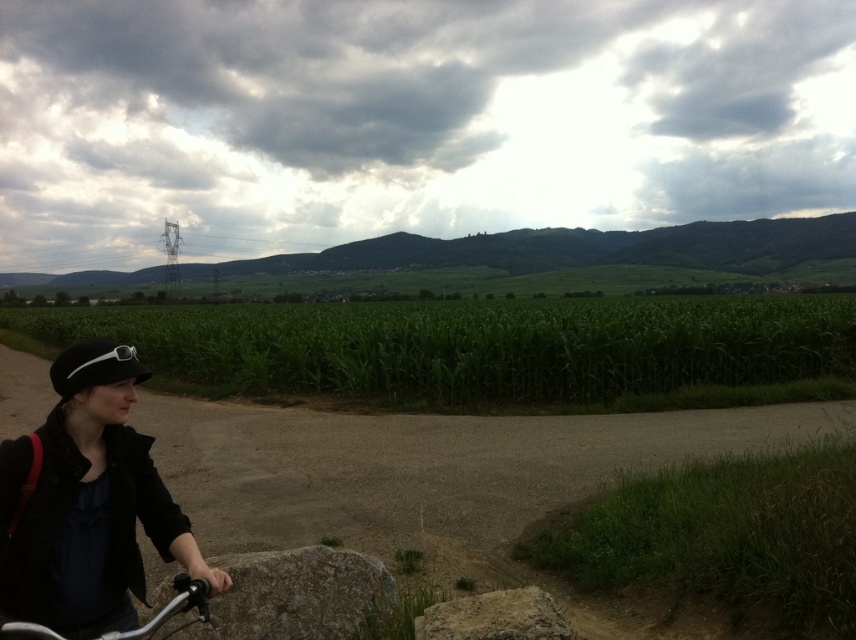
Question: Does brown gravel dirt track at lower left lie behind silver metallic bicycle at lower left?

Choices:
 (A) no
 (B) yes

Answer: (B)

Question: Which point is closer to the camera?

Choices:
 (A) rough textured rock at lower center
 (B) gray rough stone at lower center
 (C) brown gravel dirt track at lower left
 (D) black matte jacket at lower left

Answer: (D)

Question: Does brown gravel dirt track at lower left appear on the right side of rough textured rock at lower center?

Choices:
 (A) no
 (B) yes

Answer: (A)

Question: Which of the following is the closest to the observer?

Choices:
 (A) silver metallic bicycle at lower left
 (B) gray rough stone at lower center
 (C) green leafy corn at center

Answer: (A)

Question: Which object appears farthest from the camera in this image?

Choices:
 (A) silver metallic bicycle at lower left
 (B) brown gravel dirt track at lower left

Answer: (B)

Question: Is gray rough stone at lower center thinner than silver metallic bicycle at lower left?

Choices:
 (A) no
 (B) yes

Answer: (A)